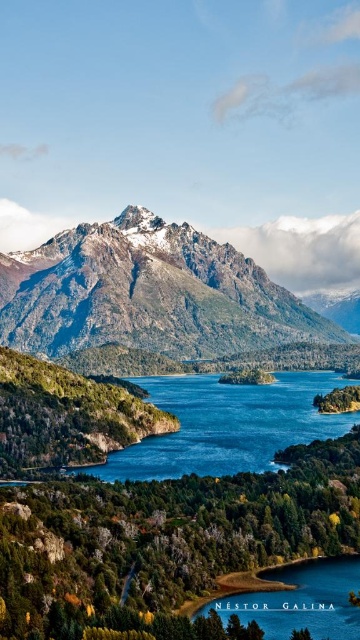
Can you confirm if rocky gray mountain at center is wider than blue glassy water at lower center?

Indeed, rocky gray mountain at center has a greater width compared to blue glassy water at lower center.

Based on the photo, between rocky gray mountain at center and blue glassy water at lower center, which one is positioned higher?

rocky gray mountain at center is above.

Identify the location of rocky gray mountain at center. This screenshot has height=640, width=360. (147, 292).

This screenshot has width=360, height=640. What are the coordinates of `rocky gray mountain at center` in the screenshot? It's located at coord(147,292).

Is rocky gray mountain at center positioned behind blue liquid water at center?

Yes, it is behind blue liquid water at center.

Is point (251, 324) positioned after point (132, 460)?

Yes, point (251, 324) is farther from viewer.

This screenshot has height=640, width=360. What are the coordinates of `rocky gray mountain at center` in the screenshot? It's located at (147, 292).

Does blue liquid water at center appear on the left side of blue glassy water at lower center?

In fact, blue liquid water at center is to the right of blue glassy water at lower center.

Is blue liquid water at center thinner than blue glassy water at lower center?

In fact, blue liquid water at center might be wider than blue glassy water at lower center.

Does point (281, 400) come in front of point (340, 600)?

No, it is not.

This screenshot has width=360, height=640. Identify the location of blue liquid water at center. (227, 426).